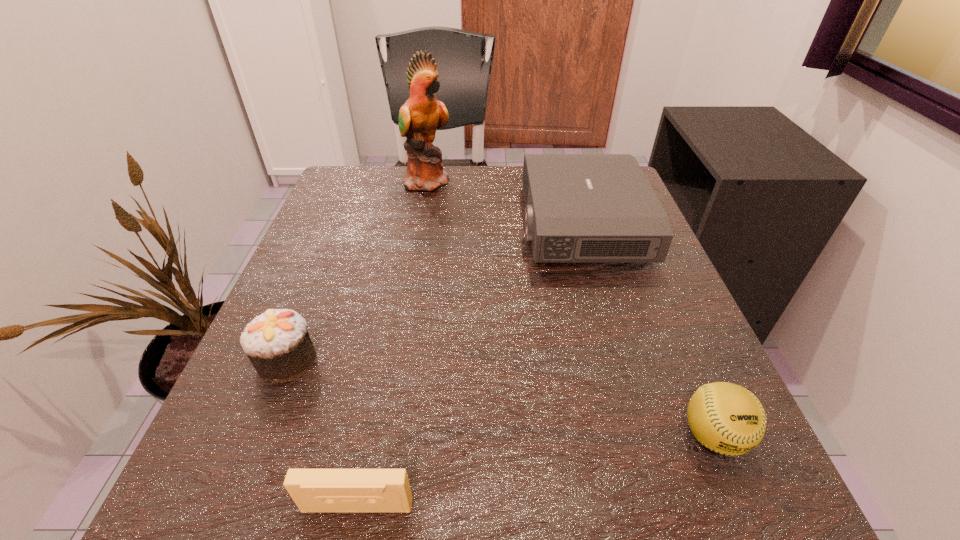
The width and height of the screenshot is (960, 540). Identify the location of vacant area between the projector and the parrot. (504, 202).

Identify the location of free space that is in between the softball and the projector. (647, 330).

You are a GUI agent. You are given a task and a screenshot of the screen. Output one action in this format:
    pyautogui.click(x=<x>, y=<y>)
    Task: Click on the free spot between the leftmost object and the projector
    The image size is (960, 540).
    Given the screenshot: What is the action you would take?
    pyautogui.click(x=434, y=293)

Find the location of a particular element. vacant region between the leftmost object and the videotape is located at coordinates (x=322, y=433).

The height and width of the screenshot is (540, 960). Identify the location of free space between the tallest object and the softball. (571, 308).

Find the location of a particular element. This screenshot has height=540, width=960. free space that is in between the projector and the parrot is located at coordinates (504, 202).

Identify the location of empty space between the videotape and the second nearest object. (536, 471).

I want to click on vacant region between the parrot and the softball, so click(571, 308).

Identify which object is the closest to the shortest object. Please provide its 2D coordinates. Your answer should be formatted as a tuple, i.e. [(x, y)], where the tuple contains the x and y coordinates of a point satisfying the conditions above.

[(277, 343)]

Select which object is the closest to the projector. Please provide its 2D coordinates. Your answer should be formatted as a tuple, i.e. [(x, y)], where the tuple contains the x and y coordinates of a point satisfying the conditions above.

[(420, 116)]